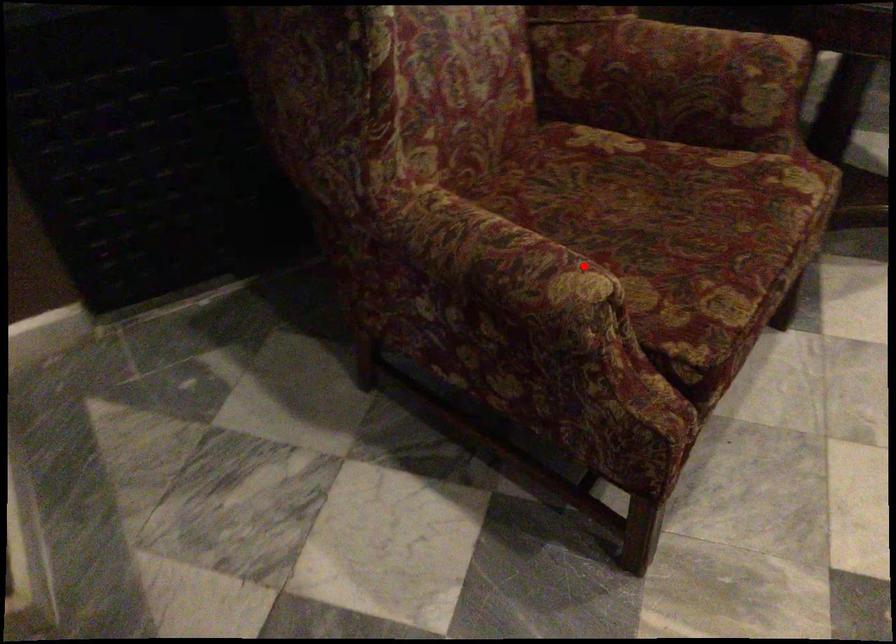
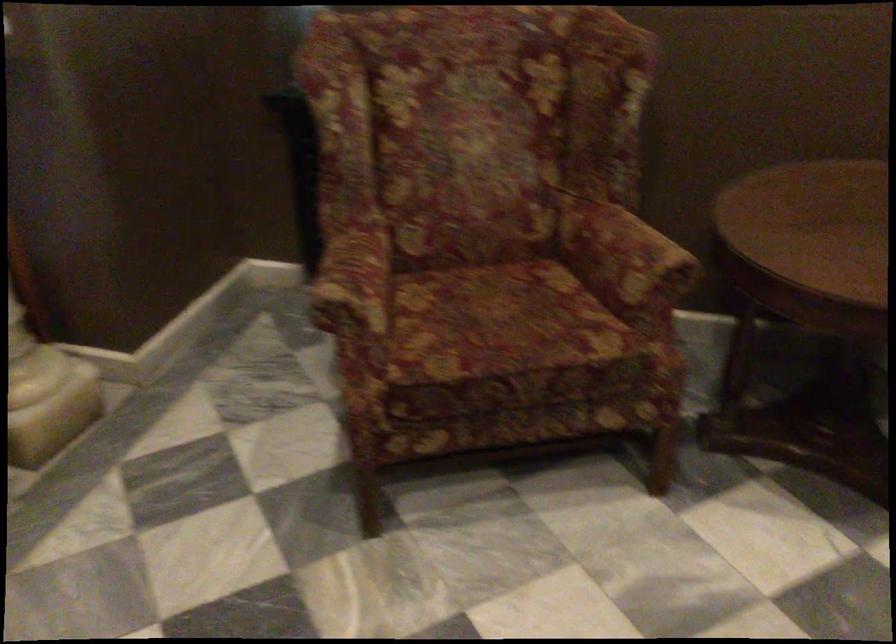
Find the pixel in the second image that matches the highlighted location in the first image.

(355, 286)